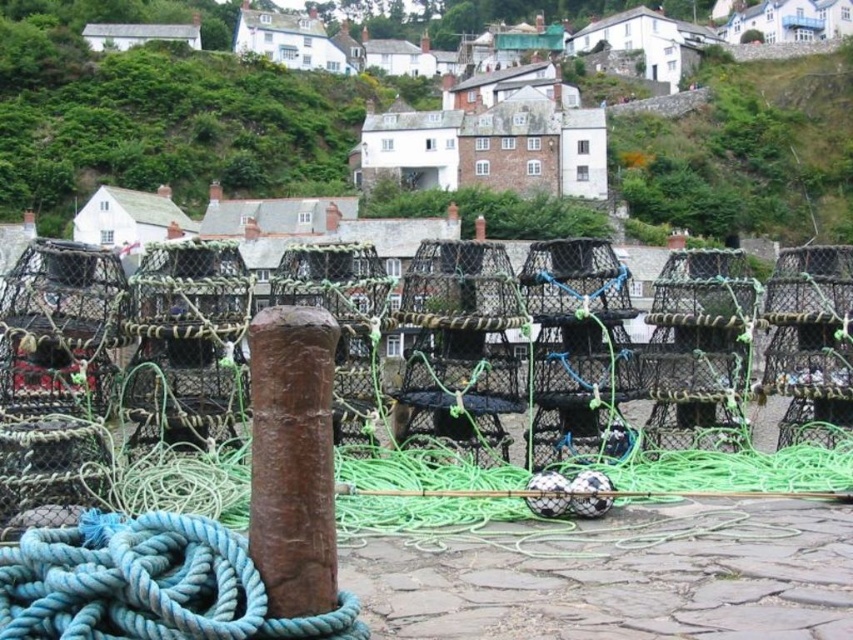
You are a fisherman trying to secure your lobster pots. You have two items in view, the blue rope at lower left and the rusty wood post at center. Which item is closer to you, the observer?

The blue rope at lower left is closer to you because it is in front of the rusty wood post at center.

You are a fisherman who needs to secure a new fishing net. You have two options in the scene, the blue rope at lower left and the rusty wood post at center. Which one is taller and thus better suited for tying the net higher up?

The blue rope at lower left is taller than the rusty wood post at center, so it is better suited for tying the net higher up.

You are a fisherman who needs to secure your lobster pots. You see the blue rope at lower left and the rusty wood post at center. Which object is located to the left of the other?

The blue rope at lower left is positioned on the left side of rusty wood post at center.